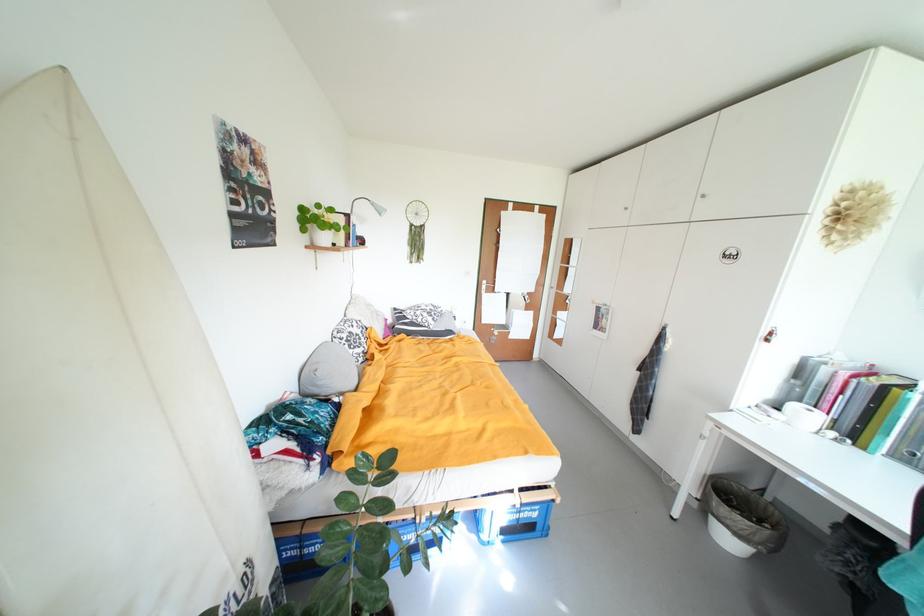
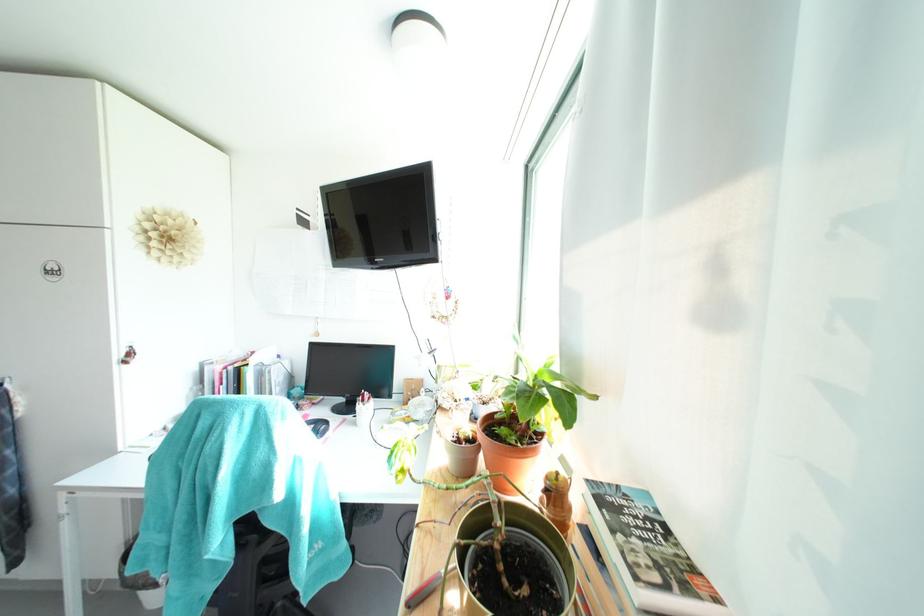
Question: The camera is either moving clockwise (left) or counter-clockwise (right) around the object. The first image is from the beginning of the video and the second image is from the end. Is the camera moving left or right when shooting the video?

Choices:
 (A) Left
 (B) Right

Answer: (A)